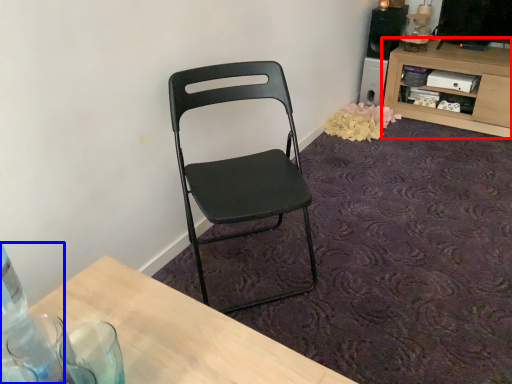
Question: Which of the following is the farthest to the observer, shelf (highlighted by a red box) or bottle (highlighted by a blue box)?

Choices:
 (A) shelf
 (B) bottle

Answer: (A)